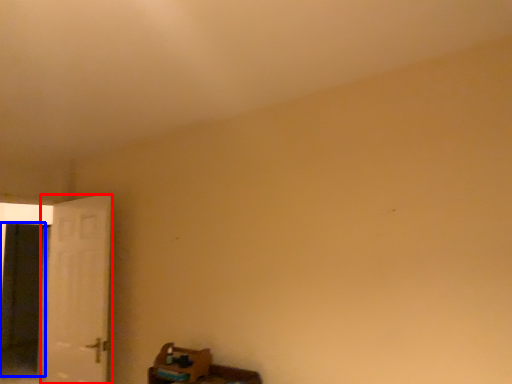
Question: Which of the following is the farthest to the observer, door (highlighted by a red box) or screen door (highlighted by a blue box)?

Choices:
 (A) door
 (B) screen door

Answer: (B)